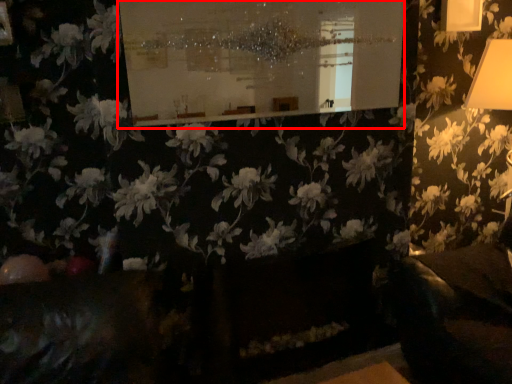
Question: From the image's perspective, where is bulletin board (annotated by the red box) located relative to flower?

Choices:
 (A) above
 (B) below

Answer: (A)